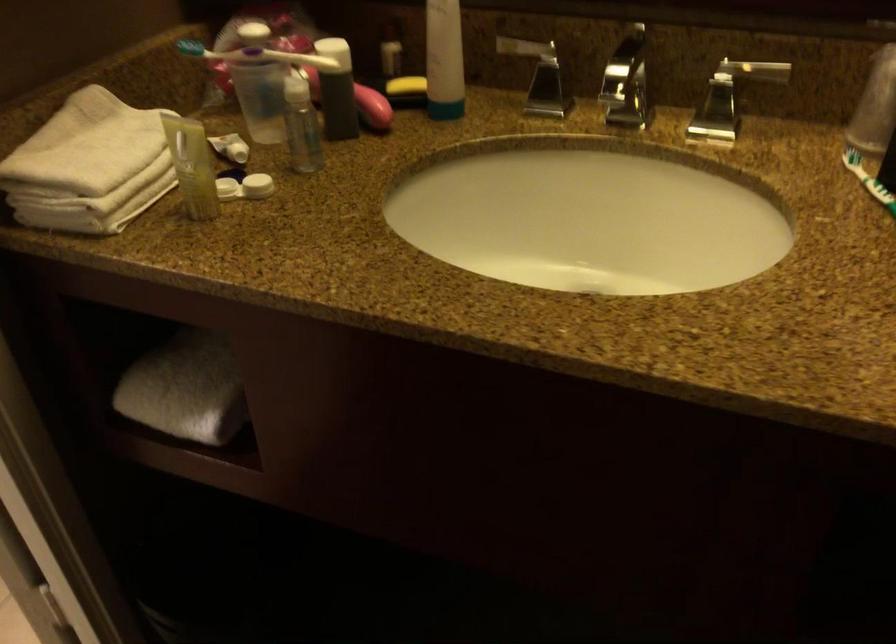
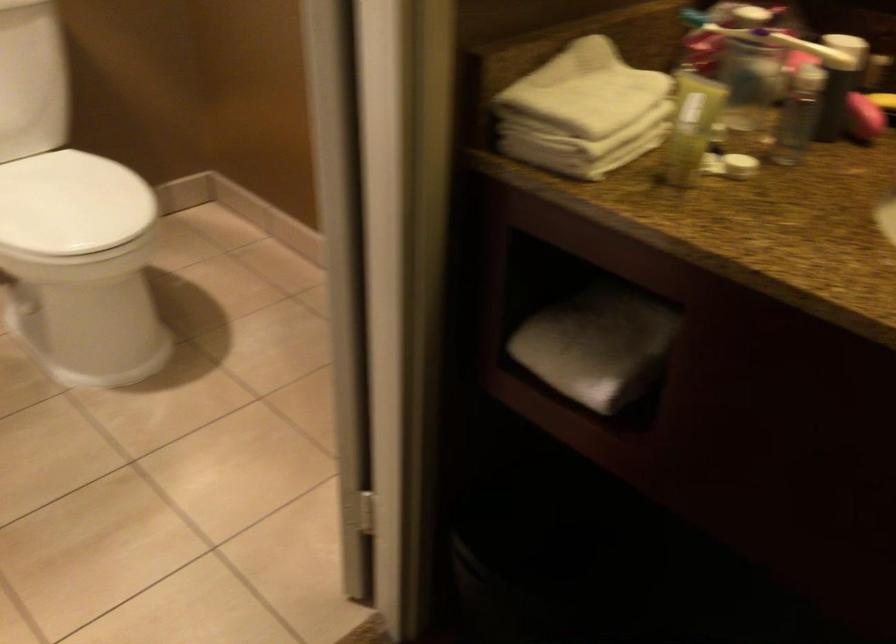
Question: The images are taken continuously from a first-person perspective. In which direction are you moving?

Choices:
 (A) Left
 (B) Right
 (C) Forward
 (D) Backward

Answer: (A)